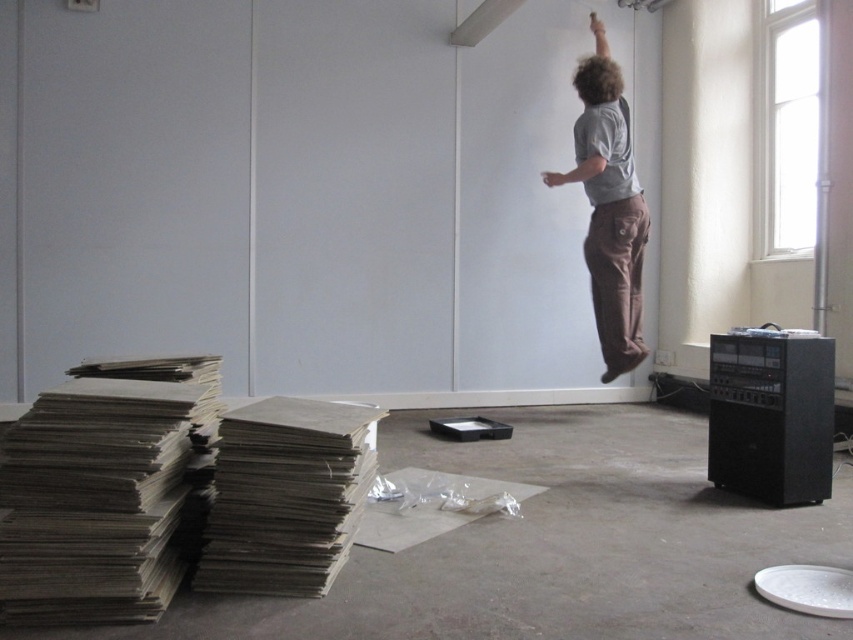
You are an interior designer planning to place a new sofa in the room. The sofa is 1.8 meters tall. You see the gray cardboard stack at lower left and the brown cotton pants at upper right. Which object is taller than the sofa?

The brown cotton pants at upper right is taller than the sofa since it is taller than the gray cardboard stack at lower left, which is shorter than the sofa.

You are a photographer setting up for a photoshoot in this room. You need to place a 2.5 feet wide backdrop between the gray cardboard stack at lower left and the brown cotton pants at upper right. Is there enough space between them to fit the backdrop?

The distance between the gray cardboard stack at lower left and the brown cotton pants at upper right is 10.11 feet. Since the backdrop is only 2.5 feet wide, there is sufficient space to place it between them.

You are a stage designer planning a magic show. You need to place a prop that requires a thick base. Which object from the scene, the gray cardboard stack at lower left or the brown cotton pants at upper right, would be more suitable for this purpose?

The brown cotton pants at upper right are thicker than the gray cardboard stack at lower left, making them more suitable as a thick base for the prop.